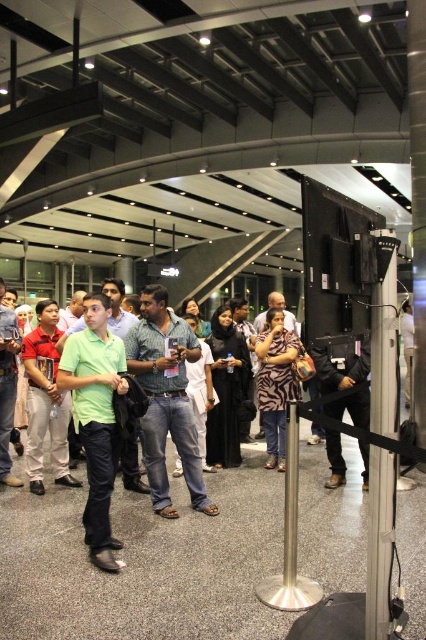
Question: Which point is closer to the camera taking this photo?

Choices:
 (A) (385, 605)
 (B) (256, 435)
 (C) (212, 515)

Answer: (A)

Question: Can you confirm if green matte shirt at center is positioned above metallic pole at center?

Choices:
 (A) yes
 (B) no

Answer: (B)

Question: Observing the image, what is the correct spatial positioning of dark gray fabric jacket at center in reference to light green shirt at center?

Choices:
 (A) right
 (B) left

Answer: (A)

Question: Which point is closer to the camera?

Choices:
 (A) (325, 410)
 (B) (259, 326)
 (C) (108, 404)

Answer: (C)

Question: Among these objects, which one is farthest from the camera?

Choices:
 (A) denim jeans at center
 (B) dark gray fabric jacket at center
 (C) zebra print shirt at center
 (D) green matte shirt at center

Answer: (C)

Question: Can you confirm if metallic pole at center is thinner than zebra print shirt at center?

Choices:
 (A) yes
 (B) no

Answer: (A)